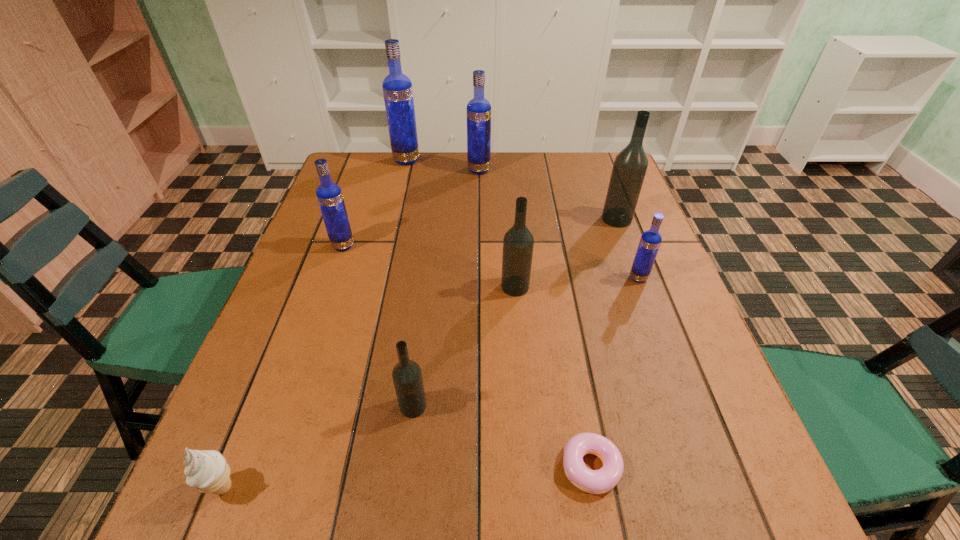
Find the location of a particular element. vacant region located 0.120m on the back of the third farthest vodka is located at coordinates (605, 187).

Where is `vacant area situated on the front of the eighth object from right to left`? vacant area situated on the front of the eighth object from right to left is located at coordinates (331, 281).

I want to click on vacant region located 0.270m on the right of the second black vodka from left to right, so click(x=646, y=287).

Locate an element on the screen. Image resolution: width=960 pixels, height=540 pixels. free space located 0.180m on the front of the nearest blue vodka is located at coordinates (663, 347).

Find the location of `vacant space situated on the back of the leftmost black vodka`. vacant space situated on the back of the leftmost black vodka is located at coordinates pyautogui.click(x=421, y=335).

Locate an element on the screen. This screenshot has height=540, width=960. free region located on the front-facing side of the eighth tallest object is located at coordinates (493, 487).

Where is `free space located 0.110m on the back of the seventh object from left to right`? The height and width of the screenshot is (540, 960). free space located 0.110m on the back of the seventh object from left to right is located at coordinates (576, 383).

You are a GUI agent. You are given a task and a screenshot of the screen. Output one action in this format:
    pyautogui.click(x=<x>, y=<y>)
    Task: Click on the icecream located at the near edge
    Image resolution: width=960 pixels, height=540 pixels.
    Given the screenshot: What is the action you would take?
    pyautogui.click(x=207, y=470)

You are a GUI agent. You are given a task and a screenshot of the screen. Output one action in this format:
    pyautogui.click(x=<x>, y=<y>)
    Task: Click on the doughnut located at the near edge
    This screenshot has height=540, width=960.
    Given the screenshot: What is the action you would take?
    pyautogui.click(x=600, y=481)

This screenshot has width=960, height=540. Find the location of `vodka present at the left edge`. vodka present at the left edge is located at coordinates (329, 195).